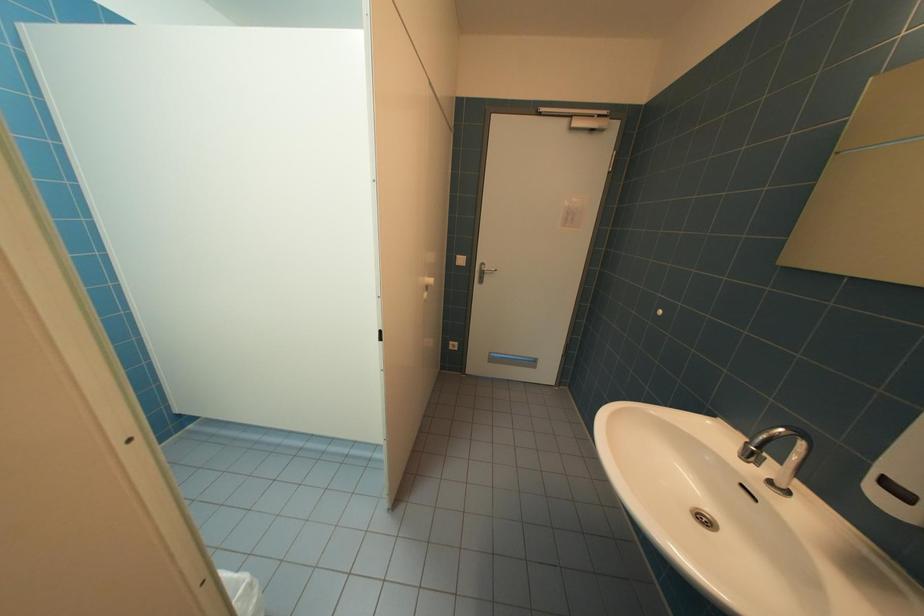
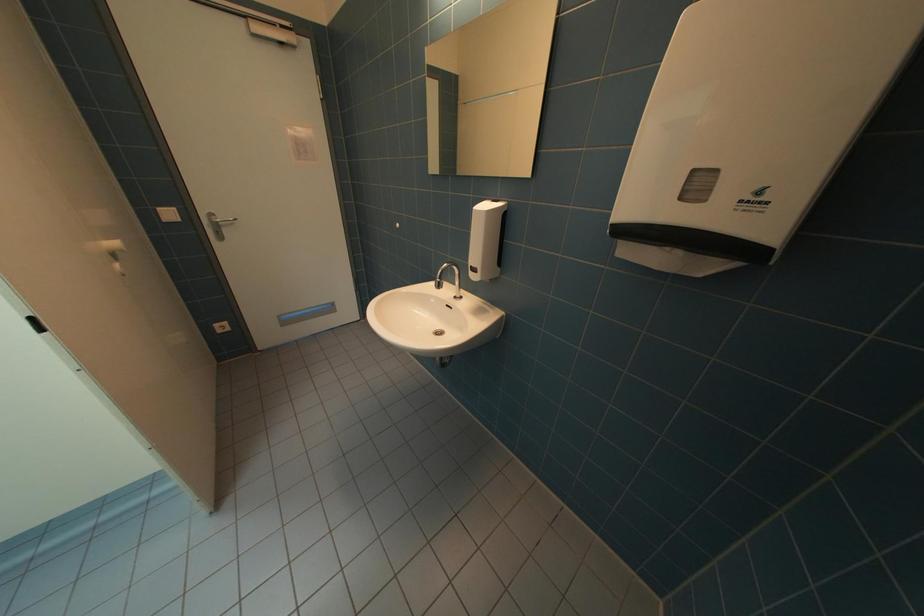
Based on the continuous images, in which direction is the camera rotating?

The camera rotated toward right-down.